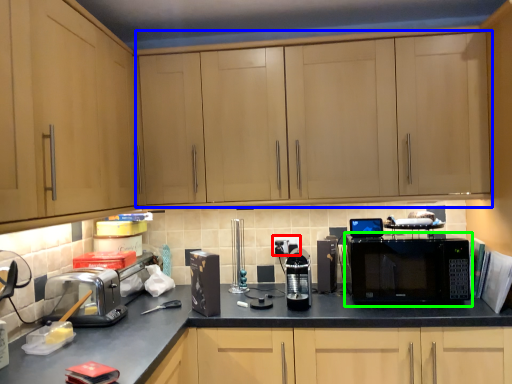
Question: Which object is the farthest from electric outlet (highlighted by a red box)? Choose among these: cabinetry (highlighted by a blue box) or microwave oven (highlighted by a green box).

Choices:
 (A) cabinetry
 (B) microwave oven

Answer: (A)